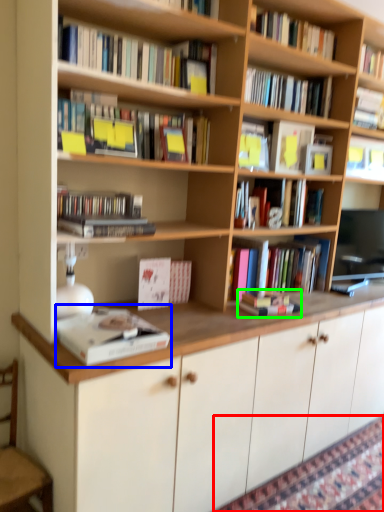
Question: Based on their relative distances, which object is farther from mat (highlighted by a red box)? Choose from book (highlighted by a blue box) and book (highlighted by a green box).

Choices:
 (A) book
 (B) book

Answer: (A)